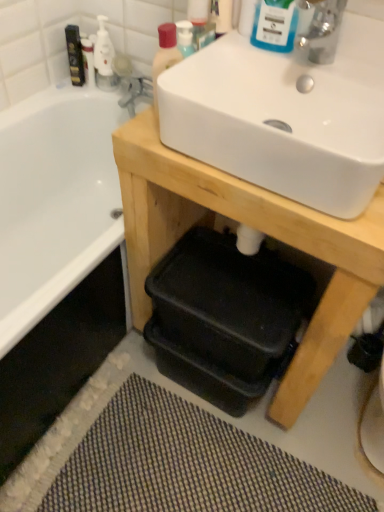
Where is `white glossy sink at upper center`? Image resolution: width=384 pixels, height=512 pixels. white glossy sink at upper center is located at coordinates (285, 117).

What do you see at coordinates (285, 117) in the screenshot?
I see `white glossy sink at upper center` at bounding box center [285, 117].

The height and width of the screenshot is (512, 384). I want to click on silver metallic faucet at upper right, so click(322, 32).

Where is `blue glossy bottle at upper center, which is the 2th mouthwash from left to right`? This screenshot has width=384, height=512. blue glossy bottle at upper center, which is the 2th mouthwash from left to right is located at coordinates click(x=275, y=25).

From a real-world perspective, which object stands above the other?

silver metallic faucet at upper right, from a real-world perspective.

Between matte black mouthwash at upper left, the 1th mouthwash positioned from the left, and silver metallic faucet at upper right, which one appears on the left side from the viewer's perspective?

Positioned to the left is matte black mouthwash at upper left, the 1th mouthwash positioned from the left.

Is matte black mouthwash at upper left, acting as the second mouthwash starting from the bottom, positioned with its back to silver metallic faucet at upper right?

No, matte black mouthwash at upper left, acting as the second mouthwash starting from the bottom,'s orientation is not away from silver metallic faucet at upper right.

In terms of width, does matte black mouthwash at upper left, the first mouthwash when ordered from back to front, look wider or thinner when compared to silver metallic faucet at upper right?

matte black mouthwash at upper left, the first mouthwash when ordered from back to front, is thinner than silver metallic faucet at upper right.

Who is smaller, textured gray bath mat at lower center or white glossy sink at upper center?

textured gray bath mat at lower center.

Is textured gray bath mat at lower center inside or outside of white glossy sink at upper center?

textured gray bath mat at lower center is spatially situated outside white glossy sink at upper center.

How different are the orientations of textured gray bath mat at lower center and white glossy sink at upper center in degrees?

4.47 degrees separate the facing orientations of textured gray bath mat at lower center and white glossy sink at upper center.

This screenshot has height=512, width=384. I want to click on bath mat that is on the left side of white glossy sink at upper center, so click(186, 464).

From a real-world perspective, is blue glossy bottle at upper center, which is the 2th mouthwash from left to right, under matte black mouthwash at upper left, acting as the first mouthwash starting from the top?

No, from a real-world perspective, blue glossy bottle at upper center, which is the 2th mouthwash from left to right, is not below matte black mouthwash at upper left, acting as the first mouthwash starting from the top.

Between blue glossy bottle at upper center, which is counted as the second mouthwash, starting from the top, and matte black mouthwash at upper left, the 1th mouthwash positioned from the left, which one appears on the right side from the viewer's perspective?

Positioned to the right is blue glossy bottle at upper center, which is counted as the second mouthwash, starting from the top.

Is matte black mouthwash at upper left, acting as the second mouthwash starting from the bottom, inside blue glossy bottle at upper center, which is the 2th mouthwash from left to right?

That's incorrect, matte black mouthwash at upper left, acting as the second mouthwash starting from the bottom, is not inside blue glossy bottle at upper center, which is the 2th mouthwash from left to right.

Between blue glossy bottle at upper center, positioned as the 1th mouthwash in right-to-left order, and matte black mouthwash at upper left, the first mouthwash when ordered from back to front, which one has smaller size?

matte black mouthwash at upper left, the first mouthwash when ordered from back to front.

Does white glossy sink at upper center have a greater height compared to blue glossy bottle at upper center, which is the first mouthwash from bottom to top?

In fact, white glossy sink at upper center may be shorter than blue glossy bottle at upper center, which is the first mouthwash from bottom to top.

Is white glossy sink at upper center oriented towards blue glossy bottle at upper center, acting as the 1th mouthwash starting from the front?

No, white glossy sink at upper center is not oriented towards blue glossy bottle at upper center, acting as the 1th mouthwash starting from the front.

How different are the orientations of matte black mouthwash at upper left, acting as the second mouthwash starting from the bottom, and white glossy bottle at upper left in degrees?

There is a 0.000622-degree angle between the facing directions of matte black mouthwash at upper left, acting as the second mouthwash starting from the bottom, and white glossy bottle at upper left.

In the scene shown: Which of these two, matte black mouthwash at upper left, the first mouthwash when ordered from back to front, or white glossy bottle at upper left, stands taller?

Standing taller between the two is white glossy bottle at upper left.

Can you confirm if matte black mouthwash at upper left, acting as the second mouthwash starting from the bottom, is positioned to the left of white glossy bottle at upper left?

Correct, you'll find matte black mouthwash at upper left, acting as the second mouthwash starting from the bottom, to the left of white glossy bottle at upper left.

Is matte black mouthwash at upper left, the first mouthwash when ordered from back to front, not near white glossy bottle at upper left?

No.

Does matte plastic bottle at upper center have a greater height compared to textured gray bath mat at lower center?

Yes.

Is matte plastic bottle at upper center thinner than textured gray bath mat at lower center?

Indeed, matte plastic bottle at upper center has a lesser width compared to textured gray bath mat at lower center.

Considering the positions of objects matte plastic bottle at upper center and textured gray bath mat at lower center in the image provided, who is more to the left, matte plastic bottle at upper center or textured gray bath mat at lower center?

From the viewer's perspective, matte plastic bottle at upper center appears more on the left side.

From a real-world perspective, is matte plastic bottle at upper center positioned above or below textured gray bath mat at lower center?

matte plastic bottle at upper center is above textured gray bath mat at lower center.

From the image's perspective, who appears lower, matte plastic bottle at upper center or white glossy bottle at upper left?

matte plastic bottle at upper center is shown below in the image.

Is point (172, 63) closer to camera compared to point (114, 88)?

Yes, point (172, 63) is in front of point (114, 88).

Is matte plastic bottle at upper center positioned with its back to white glossy bottle at upper left?

No, white glossy bottle at upper left is not at the back of matte plastic bottle at upper center.

At what (x,y) coordinates should I click in order to perform the action: click on mouthwash that is the 2nd object located above the silver metallic faucet at upper right (from the image's perspective). Please return your answer as a coordinate pair (x, y). This screenshot has width=384, height=512. Looking at the image, I should click on [75, 55].

The width and height of the screenshot is (384, 512). Find the location of `sink above the textured gray bath mat at lower center (from a real-world perspective)`. sink above the textured gray bath mat at lower center (from a real-world perspective) is located at coordinates [x=285, y=117].

Looking at this image, estimate the real-world distances between objects in this image. Which object is closer to matte black mouthwash at upper left, the first mouthwash when ordered from back to front, white glossy bottle at upper left or silver metallic faucet at upper right?

Among the two, white glossy bottle at upper left is located nearer to matte black mouthwash at upper left, the first mouthwash when ordered from back to front.

From the image, which object appears to be nearer to textured gray bath mat at lower center, silver metallic faucet at upper right or blue glossy bottle at upper center, which is counted as the second mouthwash, starting from the back?

The object closer to textured gray bath mat at lower center is silver metallic faucet at upper right.

From the picture: Based on their spatial positions, is textured gray bath mat at lower center or white glossy sink at upper center further from matte black mouthwash at upper left, the 1th mouthwash positioned from the left?

textured gray bath mat at lower center.

Considering their positions, is matte plastic bottle at upper center positioned closer to blue glossy bottle at upper center, which is counted as the second mouthwash, starting from the back, than white glossy sink at upper center?

Among the two, white glossy sink at upper center is located nearer to blue glossy bottle at upper center, which is counted as the second mouthwash, starting from the back.

In the scene shown: Considering their positions, is silver metallic faucet at upper right positioned further to wooden table at center than blue glossy bottle at upper center, which is the first mouthwash from bottom to top?

Among the two, silver metallic faucet at upper right is located further to wooden table at center.

Considering their positions, is matte plastic bottle at upper center positioned further to matte black mouthwash at upper left, acting as the first mouthwash starting from the top, than textured gray bath mat at lower center?

The object further to matte black mouthwash at upper left, acting as the first mouthwash starting from the top, is textured gray bath mat at lower center.

Looking at this image, which object lies nearer to the anchor point wooden table at center, textured gray bath mat at lower center or silver metallic faucet at upper right?

textured gray bath mat at lower center.

Which object lies further to the anchor point textured gray bath mat at lower center, matte plastic bottle at upper center or silver metallic faucet at upper right?

The object further to textured gray bath mat at lower center is silver metallic faucet at upper right.

I want to click on bottle located between blue glossy bottle at upper center, which is the first mouthwash from bottom to top, and white glossy bottle at upper left in the depth direction, so click(x=164, y=56).

The width and height of the screenshot is (384, 512). What are the coordinates of `bottle positioned between silver metallic faucet at upper right and matte black mouthwash at upper left, acting as the second mouthwash starting from the bottom, from near to far` in the screenshot? It's located at (164, 56).

At what (x,y) coordinates should I click in order to perform the action: click on bottle between silver metallic faucet at upper right and white glossy bottle at upper left along the z-axis. Please return your answer as a coordinate pair (x, y). The image size is (384, 512). Looking at the image, I should click on (164, 56).

You are a GUI agent. You are given a task and a screenshot of the screen. Output one action in this format:
    pyautogui.click(x=<x>, y=<y>)
    Task: Click on the mouthwash between blue glossy bottle at upper center, which is counted as the second mouthwash, starting from the back, and white glossy bottle at upper left from front to back
    This screenshot has height=512, width=384.
    Given the screenshot: What is the action you would take?
    pyautogui.click(x=75, y=55)